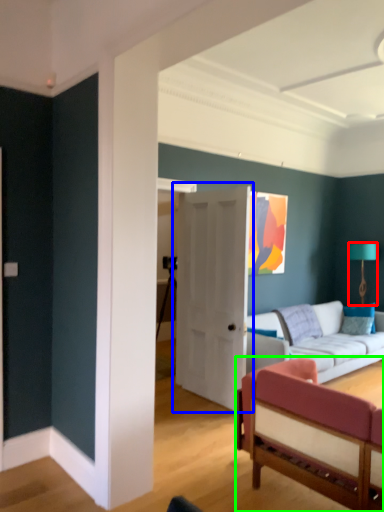
Question: Considering the real-world distances, which object is farthest from lamp (highlighted by a red box)? door (highlighted by a blue box) or studio couch (highlighted by a green box)?

Choices:
 (A) door
 (B) studio couch

Answer: (B)